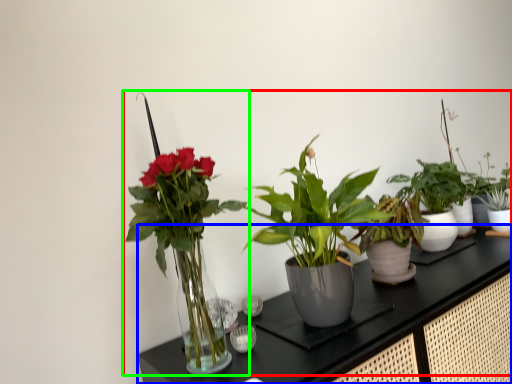
Question: Considering the real-world distances, which object is closest to houseplant (highlighted by a red box)? counter (highlighted by a blue box) or houseplant (highlighted by a green box).

Choices:
 (A) counter
 (B) houseplant

Answer: (A)